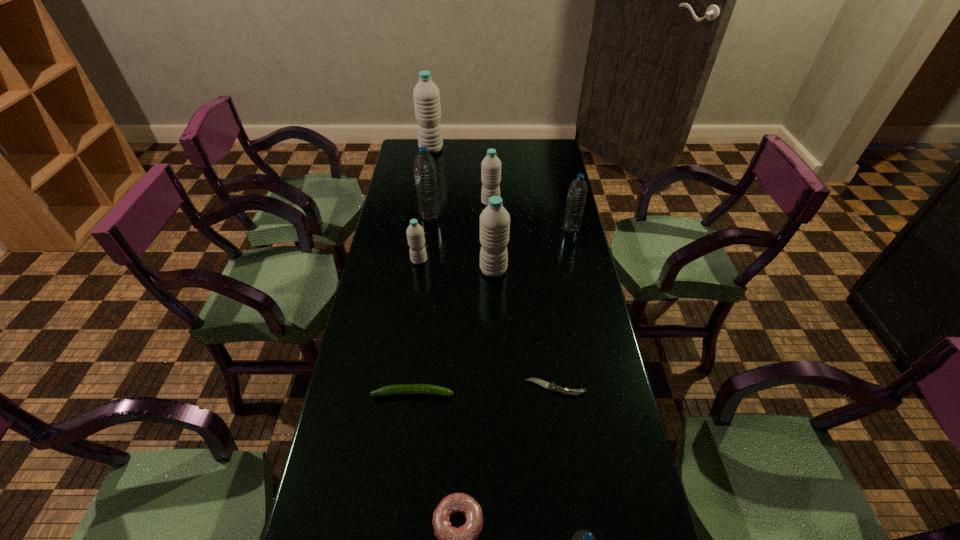
You are a GUI agent. You are given a task and a screenshot of the screen. Output one action in this format:
    pyautogui.click(x=<x>, y=<y>)
    Task: Click on the object located in the far edge section of the desktop
    
    Given the screenshot: What is the action you would take?
    pyautogui.click(x=426, y=94)

Locate an element on the screen. zucchini situated at the left edge is located at coordinates (401, 389).

Locate an element on the screen. The image size is (960, 540). water bottle at the right edge is located at coordinates (577, 193).

Find the location of `pocketknife located in the right edge section of the desktop`. pocketknife located in the right edge section of the desktop is located at coordinates (551, 386).

Find the location of `object present at the far left corner`. object present at the far left corner is located at coordinates (426, 94).

The width and height of the screenshot is (960, 540). In the image, there is a desktop. In order to click on free space at the far edge in this screenshot , I will do `click(474, 146)`.

Locate an element on the screen. This screenshot has width=960, height=540. free point at the left edge is located at coordinates (390, 305).

In the image, there is a desktop. At what (x,y) coordinates should I click in order to perform the action: click on vacant space at the right edge. Please return your answer as a coordinate pair (x, y). Image resolution: width=960 pixels, height=540 pixels. Looking at the image, I should click on (640, 526).

In order to click on vacant region at the far right corner of the desktop in this screenshot , I will do `click(528, 163)`.

You are a GUI agent. You are given a task and a screenshot of the screen. Output one action in this format:
    pyautogui.click(x=<x>, y=<y>)
    Task: Click on the free space between the pocketknife and the third farthest object
    The height and width of the screenshot is (540, 960).
    Given the screenshot: What is the action you would take?
    pyautogui.click(x=492, y=302)